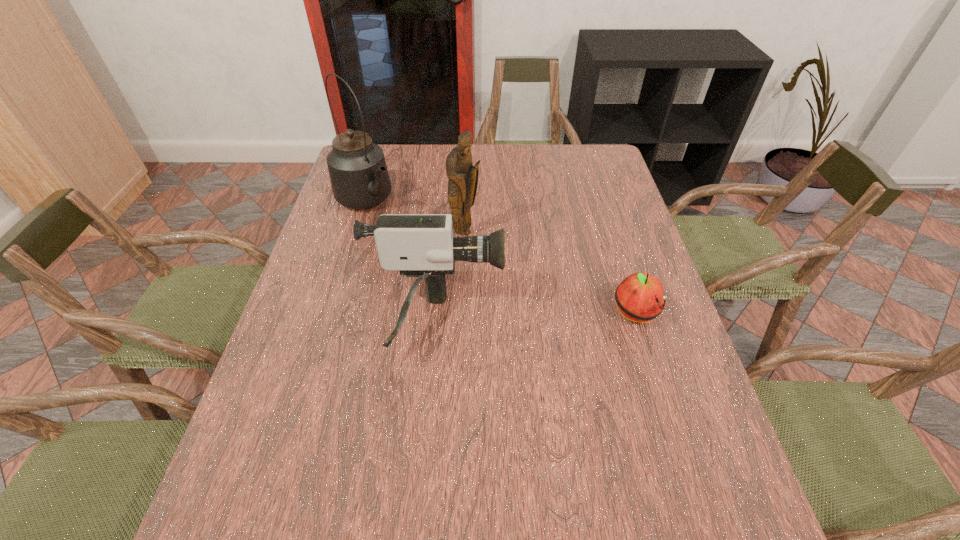
The image size is (960, 540). I want to click on vacant spot on the desktop that is between the camcorder and the apple and is positioned spout on the kettle, so pyautogui.click(x=515, y=319).

Image resolution: width=960 pixels, height=540 pixels. Find the location of `vacant space on the desktop that is between the camcorder and the shortest object and is positioned on the front-facing side of the figurine`. vacant space on the desktop that is between the camcorder and the shortest object and is positioned on the front-facing side of the figurine is located at coordinates (563, 317).